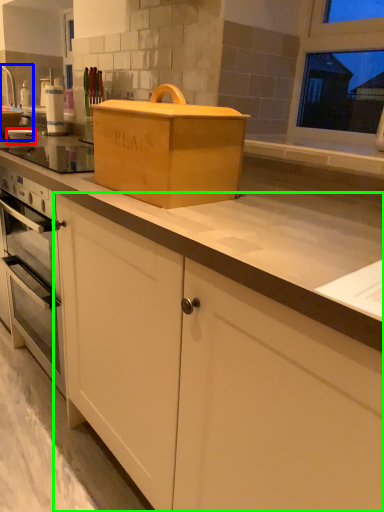
Question: Estimate the real-world distances between objects in this image. Which object is farther from appliance (highlighted by a red box), sink (highlighted by a blue box) or cabinetry (highlighted by a green box)?

Choices:
 (A) sink
 (B) cabinetry

Answer: (B)